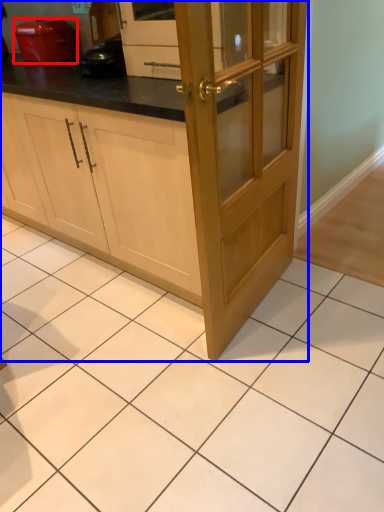
Question: Which point is further to the camera, home appliance (highlighted by a red box) or cabinetry (highlighted by a blue box)?

Choices:
 (A) home appliance
 (B) cabinetry

Answer: (A)